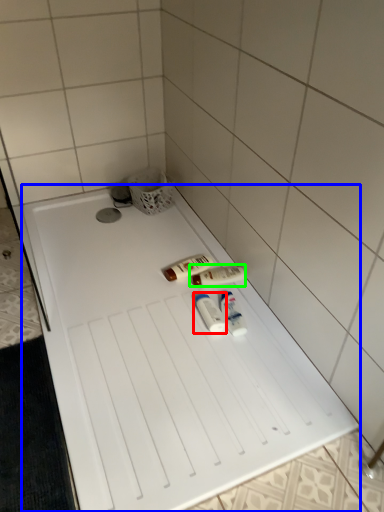
Question: Estimate the real-world distances between objects in this image. Which object is closer to toiletry (highlighted by a red box), furniture (highlighted by a blue box) or toiletry (highlighted by a green box)?

Choices:
 (A) furniture
 (B) toiletry

Answer: (B)